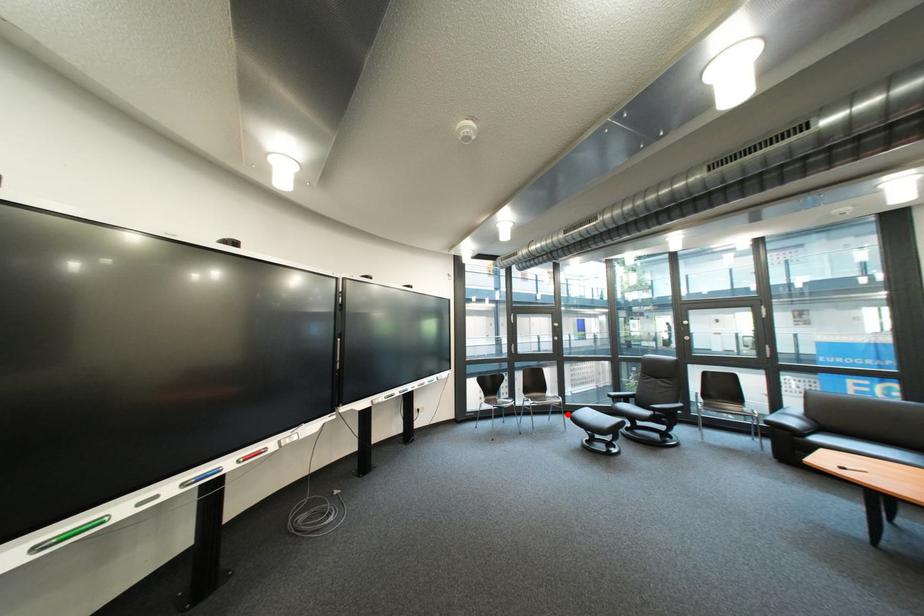
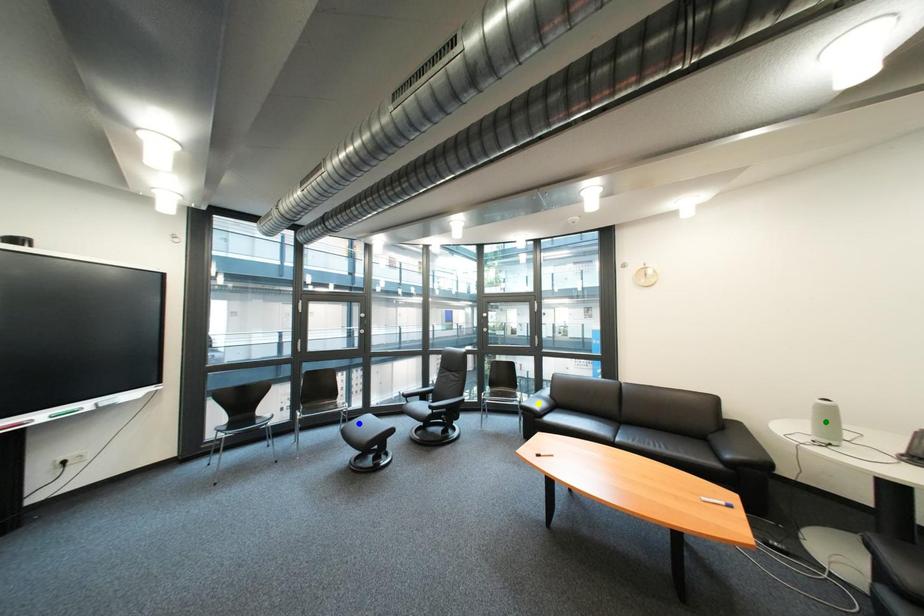
Question: I am providing you with two images of the same scene from different viewpoints. A red point is marked on the first image. You are given multiple points on the second image. In image 2, which mark is for the same physical point as the one in image 1?

Choices:
 (A) blue point
 (B) yellow point
 (C) green point

Answer: (A)